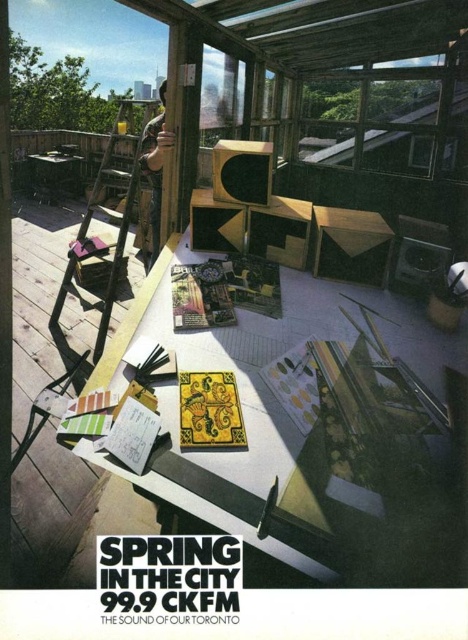
You are standing on the wooden deck and looking at two points marked on the deck. The first point is at coordinates point (21, 339) and the second point is at point (115, 260). Which point is closer to you?

Point (21, 339) is further to the viewer than point (115, 260), so the second point is closer to you.

Consider the image. You are a painter who needs to set up an easel on the wooden deck at left. The wooden ladder at left is currently occupying some space. Can you fit the easel there without moving the ladder?

The wooden deck at left is bigger than the wooden ladder at left, so there should be enough space to place the easel without moving the ladder.

You are organizing a small outdoor event and need to place a 2x2 meter tent on the wooden deck at left or the matte black table at left. Based on their sizes, which surface can accommodate the tent?

The wooden deck at left is bigger than the matte black table at left, so the tent can be placed on the wooden deck at left.